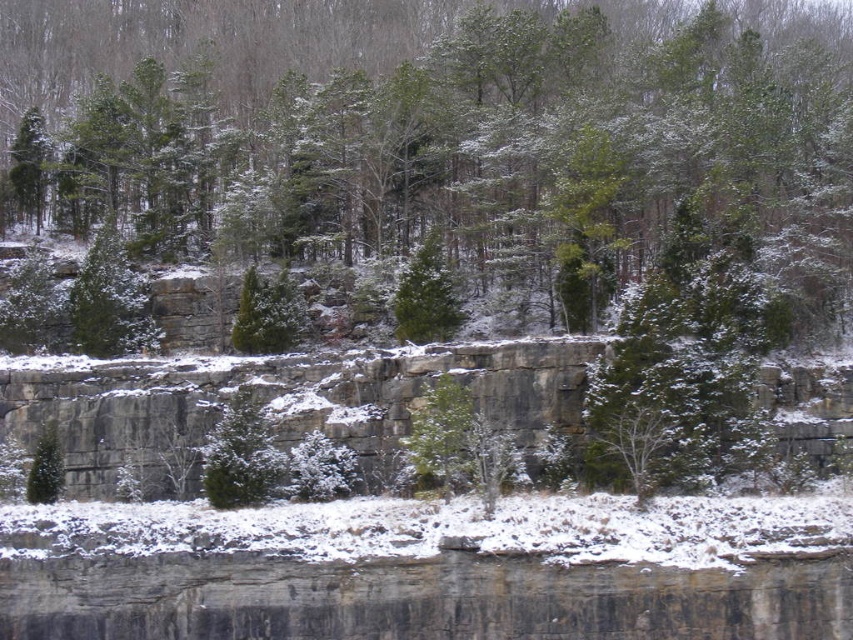
Question: Which object is farther from the camera taking this photo?

Choices:
 (A) green matte tree at center
 (B) gray rock cliff at center

Answer: (A)

Question: From the image, what is the correct spatial relationship of gray rock cliff at center in relation to green matte tree at center?

Choices:
 (A) above
 (B) below

Answer: (B)

Question: Can you confirm if gray rock cliff at center is thinner than green matte tree at center?

Choices:
 (A) yes
 (B) no

Answer: (B)

Question: Can you confirm if gray rock cliff at center is smaller than green matte tree at center?

Choices:
 (A) yes
 (B) no

Answer: (B)

Question: Which object is closer to the camera taking this photo?

Choices:
 (A) gray rock cliff at center
 (B) green matte tree at center

Answer: (A)